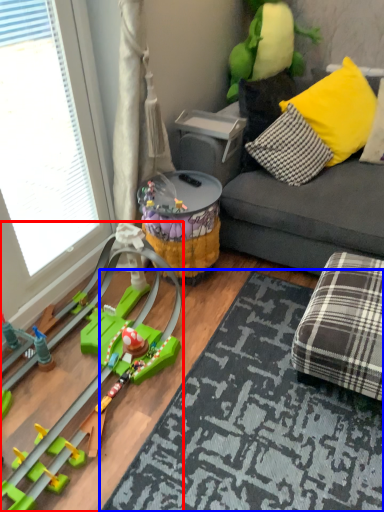
Question: Which of the following is the closest to the observer, toy (highlighted by a red box) or mat (highlighted by a blue box)?

Choices:
 (A) toy
 (B) mat

Answer: (A)